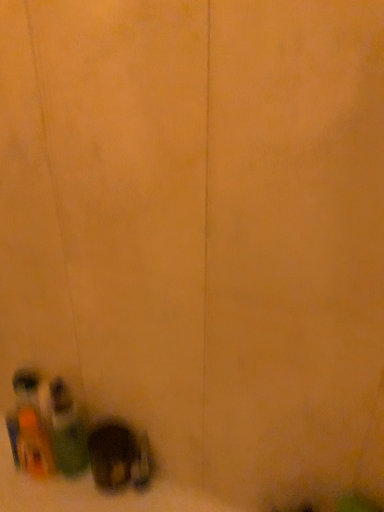
Where is `translucent plastic bottles at bottom left`? This screenshot has width=384, height=512. translucent plastic bottles at bottom left is located at coordinates (29, 428).

Image resolution: width=384 pixels, height=512 pixels. Describe the element at coordinates (29, 428) in the screenshot. I see `translucent plastic bottles at bottom left` at that location.

This screenshot has width=384, height=512. In order to click on translucent plastic bottles at bottom left in this screenshot , I will do `click(29, 428)`.